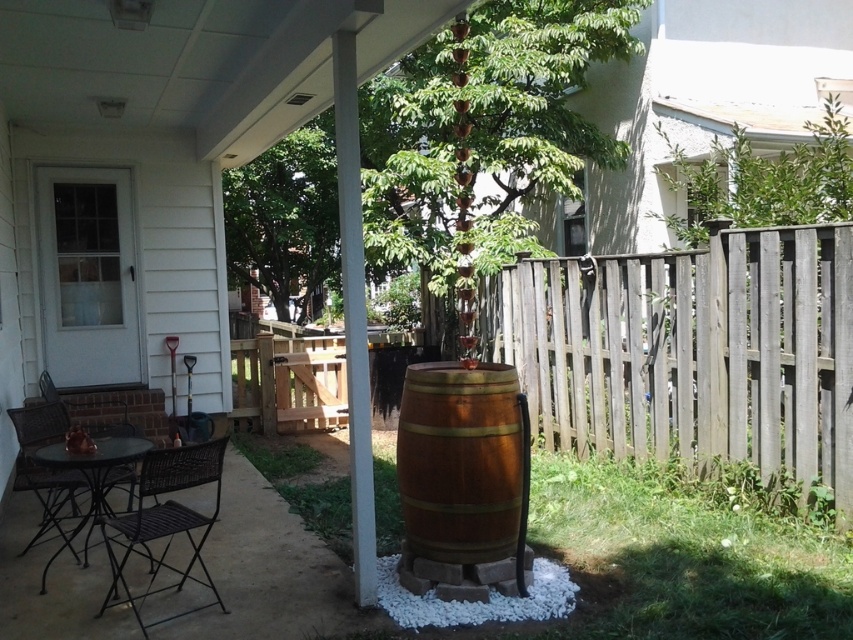
Question: Which object is positioned closest to the weathered wood fence at right?

Choices:
 (A) metallic brown chair at lower left
 (B) wooden barrel at center
 (C) matte black table at lower left
 (D) black wicker chair at lower left

Answer: (B)

Question: Can you confirm if weathered wood fence at right is positioned to the left of wooden barrel at center?

Choices:
 (A) no
 (B) yes

Answer: (A)

Question: Which object is positioned farthest from the matte black table at lower left?

Choices:
 (A) wooden barrel at center
 (B) weathered wood fence at right
 (C) black wicker chair at lower left

Answer: (B)

Question: Which is nearer to the wooden barrel at center?

Choices:
 (A) metallic brown chair at lower left
 (B) matte black table at lower left

Answer: (B)

Question: Is black wicker chair at lower left wider than matte black table at lower left?

Choices:
 (A) yes
 (B) no

Answer: (A)

Question: Is black wicker chair at lower left above metallic brown chair at lower left?

Choices:
 (A) yes
 (B) no

Answer: (B)